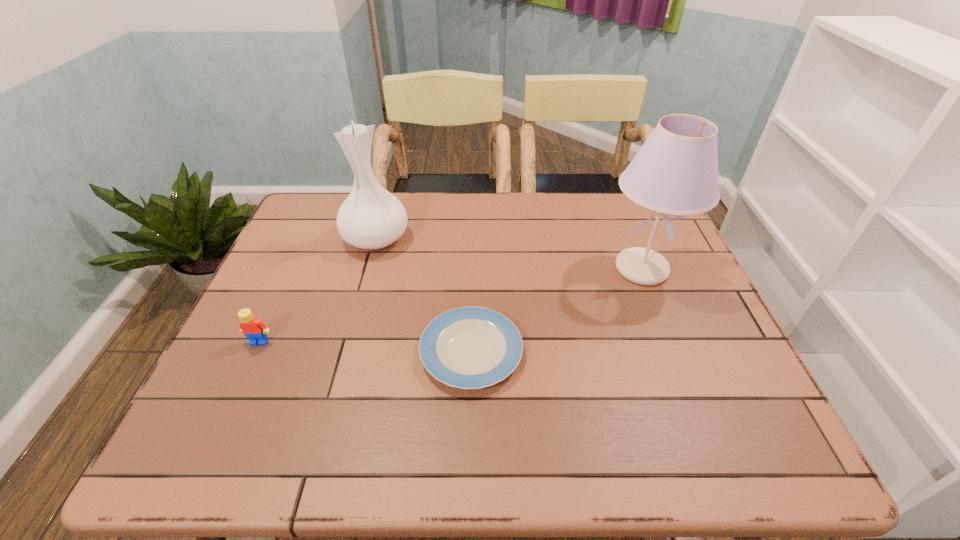
Locate an element on the screen. The height and width of the screenshot is (540, 960). free space located on the face of the second shortest object is located at coordinates (222, 423).

What are the coordinates of `blank space located on the front of the third object from left to right` in the screenshot? It's located at click(x=469, y=437).

Image resolution: width=960 pixels, height=540 pixels. I want to click on object located in the far edge section of the desktop, so click(x=372, y=218).

At what (x,y) coordinates should I click in order to perform the action: click on object at the left edge. Please return your answer as a coordinate pair (x, y). The width and height of the screenshot is (960, 540). Looking at the image, I should click on (255, 330).

Find the location of `object that is at the right edge`. object that is at the right edge is located at coordinates (675, 172).

The width and height of the screenshot is (960, 540). Find the location of `free space at the far edge`. free space at the far edge is located at coordinates (490, 226).

This screenshot has height=540, width=960. I want to click on free space at the near edge of the desktop, so click(x=567, y=426).

This screenshot has width=960, height=540. In the image, there is a desktop. Identify the location of vacant space at the left edge. (282, 280).

Locate an element on the screen. Image resolution: width=960 pixels, height=540 pixels. vacant space at the right edge of the desktop is located at coordinates (672, 244).

At what (x,y) coordinates should I click in order to perform the action: click on free space at the far left corner of the desktop. Please return your answer as a coordinate pair (x, y). Looking at the image, I should click on tap(336, 218).